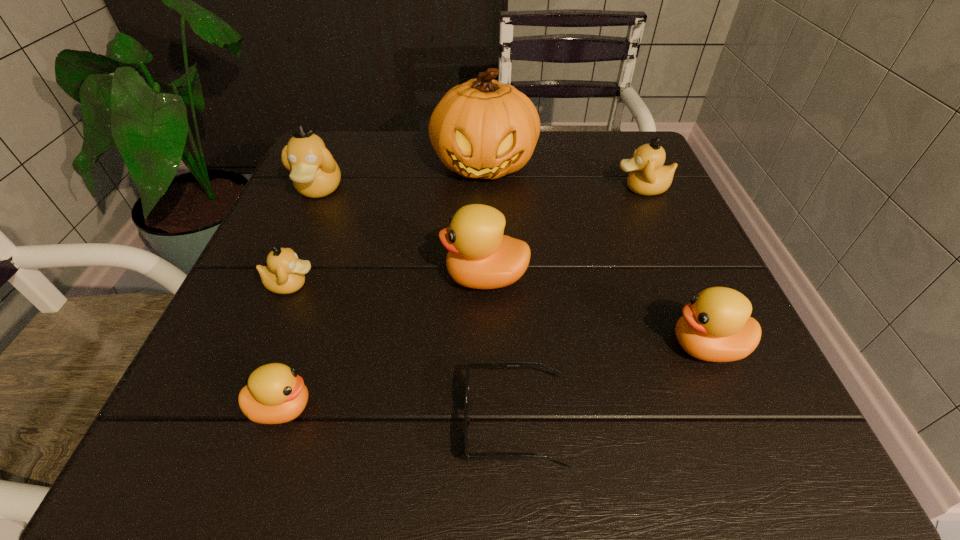
Locate an element on the screen. sunglasses at the near edge is located at coordinates (470, 364).

At what (x,y) coordinates should I click in order to perform the action: click on object that is at the far left corner. Please return your answer as a coordinate pair (x, y). This screenshot has height=540, width=960. Looking at the image, I should click on (314, 172).

Locate an element on the screen. Image resolution: width=960 pixels, height=540 pixels. object that is at the near left corner is located at coordinates (275, 394).

This screenshot has width=960, height=540. In order to click on object at the far right corner in this screenshot , I will do `click(648, 176)`.

In the image, there is a desktop. What are the coordinates of `vacant region at the far edge` in the screenshot? It's located at (385, 140).

The image size is (960, 540). Find the location of `free location at the near edge`. free location at the near edge is located at coordinates (446, 419).

The width and height of the screenshot is (960, 540). Identify the location of vacant space at the left edge of the desktop. (246, 341).

Where is `vacant space at the right edge of the desktop`? The height and width of the screenshot is (540, 960). vacant space at the right edge of the desktop is located at coordinates (641, 232).

This screenshot has width=960, height=540. What are the coordinates of `blank region between the nearest duckling and the second biggest tan duckling` in the screenshot? It's located at (462, 298).

Find the location of a particular element. This screenshot has height=540, width=960. unoccupied position between the nearest yellow duckling and the smallest tan duckling is located at coordinates (287, 346).